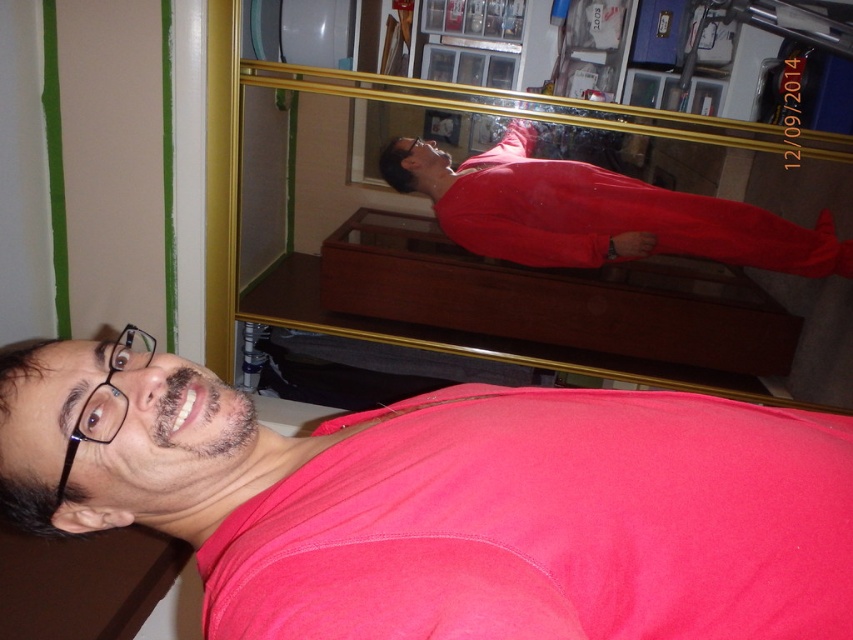
Is glossy glass mirror at upper center above matte red jumpsuit at center?

No, glossy glass mirror at upper center is not above matte red jumpsuit at center.

Can you confirm if glossy glass mirror at upper center is smaller than matte red jumpsuit at center?

Incorrect, glossy glass mirror at upper center is not smaller in size than matte red jumpsuit at center.

Between point (468, 134) and point (637, 227), which one is positioned in front?

Point (468, 134) is in front.

Find the location of a particular element. glossy glass mirror at upper center is located at coordinates (549, 268).

Does pink matte shirt at lower center appear on the left side of matte red jumpsuit at center?

Correct, you'll find pink matte shirt at lower center to the left of matte red jumpsuit at center.

Is point (444, 625) farther from viewer compared to point (474, 184)?

No, (444, 625) is closer to viewer.

Find the location of a particular element. The height and width of the screenshot is (640, 853). pink matte shirt at lower center is located at coordinates (448, 504).

Does pink matte shirt at lower center have a larger size compared to glossy glass mirror at upper center?

No.

The width and height of the screenshot is (853, 640). Describe the element at coordinates (448, 504) in the screenshot. I see `pink matte shirt at lower center` at that location.

Which is in front, point (366, 516) or point (364, 148)?

Positioned in front is point (366, 516).

Locate an element on the screen. pink matte shirt at lower center is located at coordinates (448, 504).